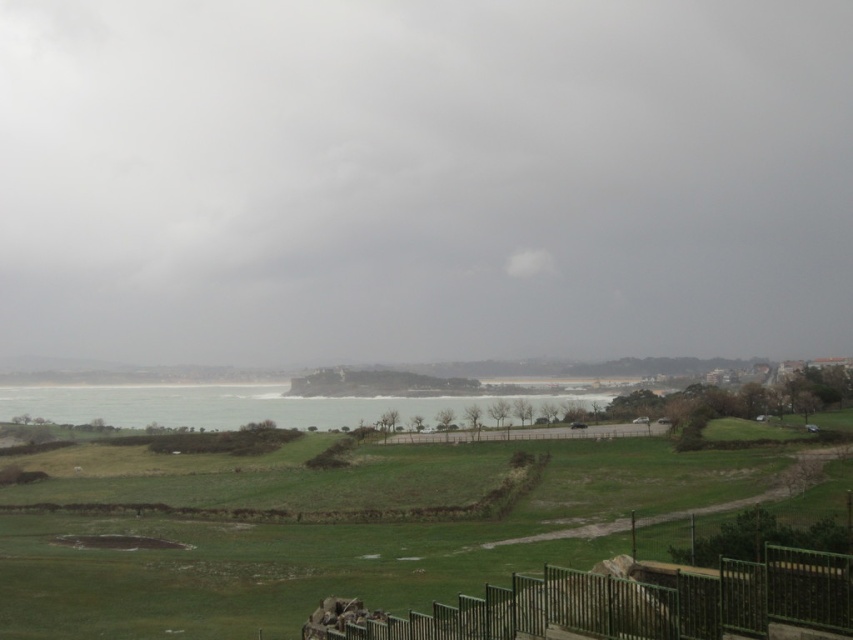
Question: Which is nearer to the green water at center?

Choices:
 (A) gray cloudy sky at upper center
 (B) green grassy field at lower center

Answer: (B)

Question: Does gray cloudy sky at upper center come in front of green metal fence at lower center?

Choices:
 (A) no
 (B) yes

Answer: (A)

Question: Can you confirm if green metal fence at lower center is positioned to the right of green water at center?

Choices:
 (A) yes
 (B) no

Answer: (A)

Question: Which object appears farthest from the camera in this image?

Choices:
 (A) green metal fence at lower center
 (B) gray cloudy sky at upper center
 (C) green grassy field at lower center

Answer: (B)

Question: Considering the real-world distances, which object is farthest from the gray cloudy sky at upper center?

Choices:
 (A) green metal fence at lower center
 (B) green water at center
 (C) green grassy field at lower center

Answer: (A)

Question: Can you confirm if green grassy field at lower center is positioned to the left of green metal fence at lower center?

Choices:
 (A) yes
 (B) no

Answer: (A)